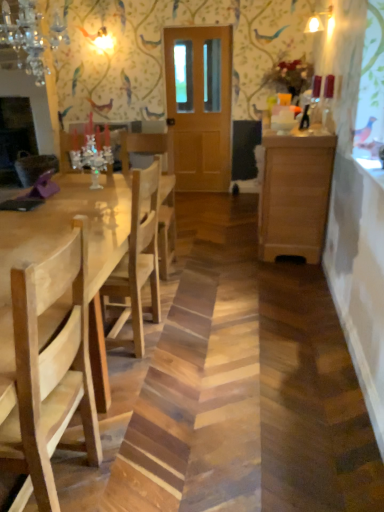
Question: Considering the positions of wooden cabinet at right and natural wood table at left in the image, is wooden cabinet at right taller or shorter than natural wood table at left?

Choices:
 (A) short
 (B) tall

Answer: (B)

Question: In terms of width, does wooden cabinet at right look wider or thinner when compared to natural wood table at left?

Choices:
 (A) thin
 (B) wide

Answer: (A)

Question: Which is nearer to the natural wood chair at left?

Choices:
 (A) wooden cabinet at right
 (B) crystal glass chandelier at upper left
 (C) wooden door at center
 (D) natural wood table at left

Answer: (D)

Question: Which object is the closest to the crystal glass chandelier at upper left?

Choices:
 (A) natural wood chair at left
 (B) wooden door at center
 (C) wooden cabinet at right
 (D) natural wood table at left

Answer: (D)